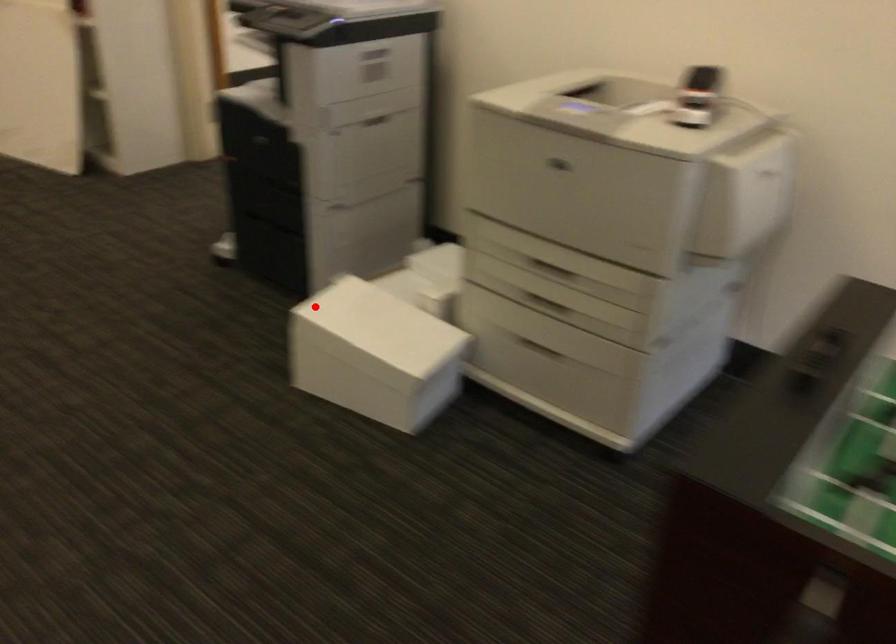
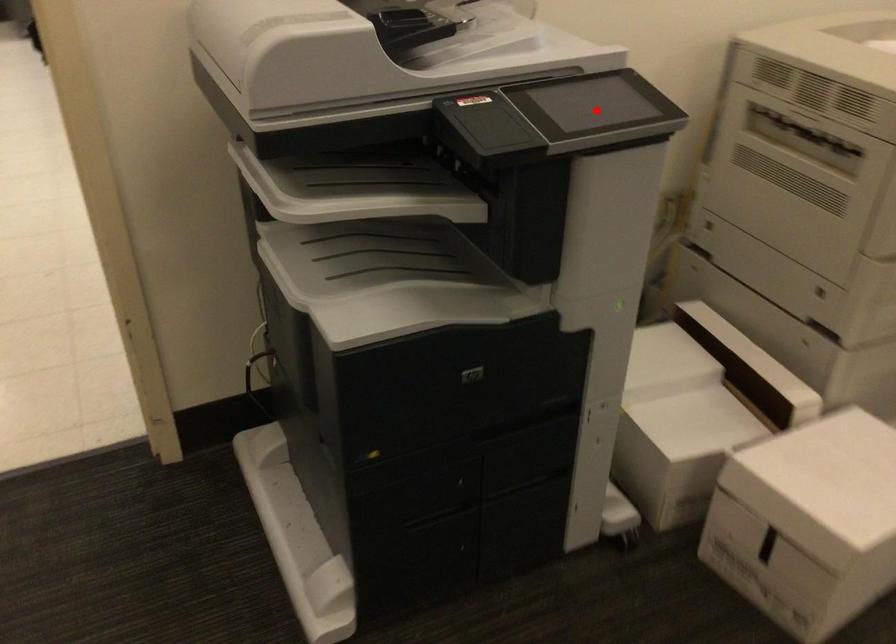
I am providing you with two images of the same scene from different viewpoints. A red point is marked on the first image and another point is marked on the second image. Are the points marked in image1 and image2 representing the same 3D position?

No